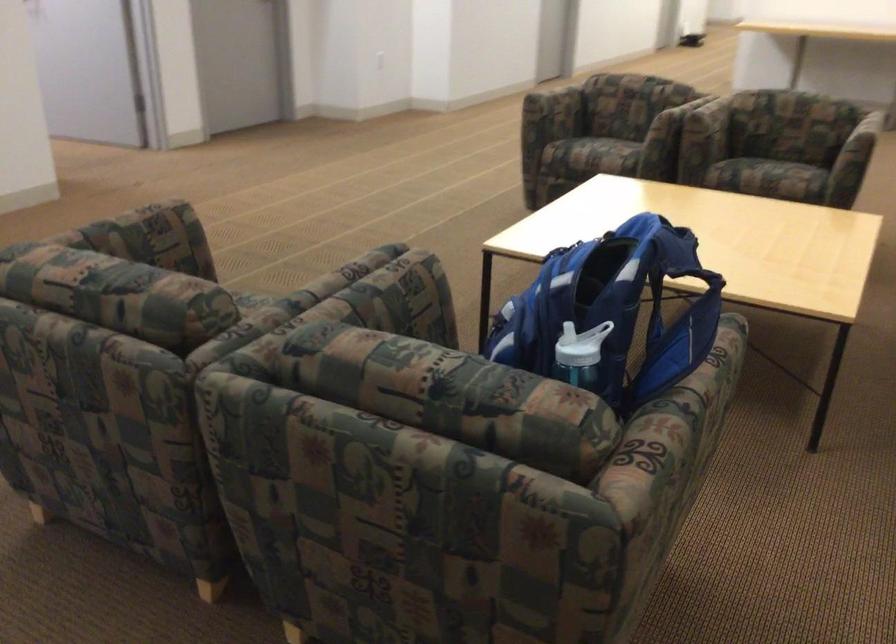
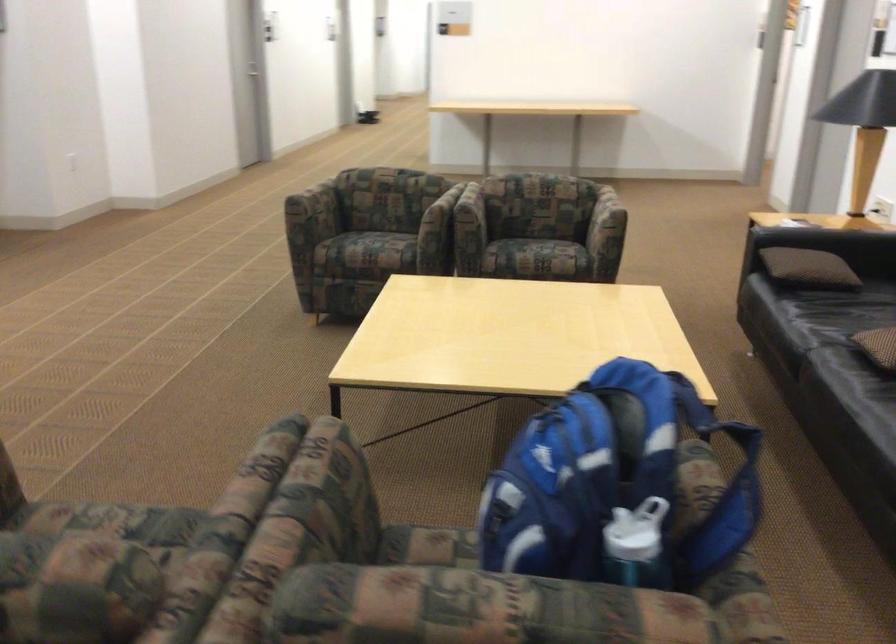
Question: The first image is from the beginning of the video and the second image is from the end. How did the camera likely rotate when shooting the video?

Choices:
 (A) Left
 (B) Right
 (C) Up
 (D) Down

Answer: (B)